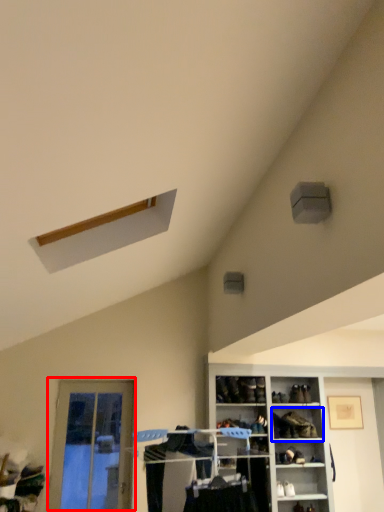
Question: Which of the following is the farthest to the observer, door (highlighted by a red box) or shelf (highlighted by a blue box)?

Choices:
 (A) door
 (B) shelf

Answer: (B)